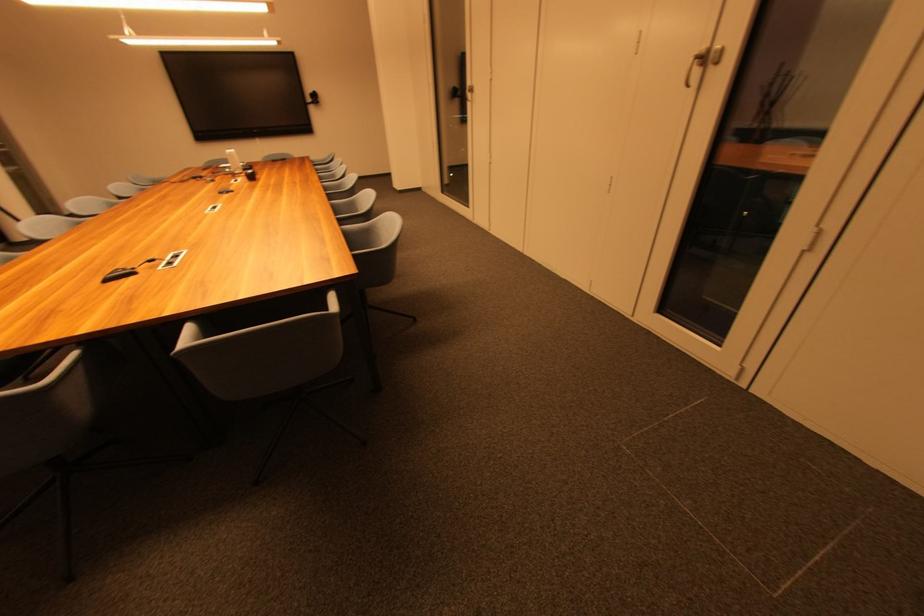
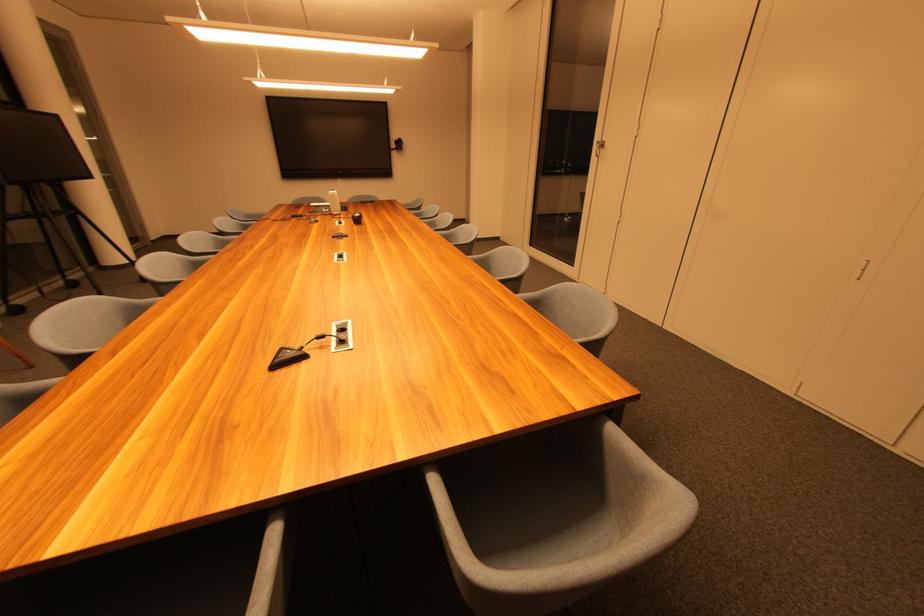
Which direction would the cameraman need to move to produce the second image?

The cameraman moved toward left, forward.